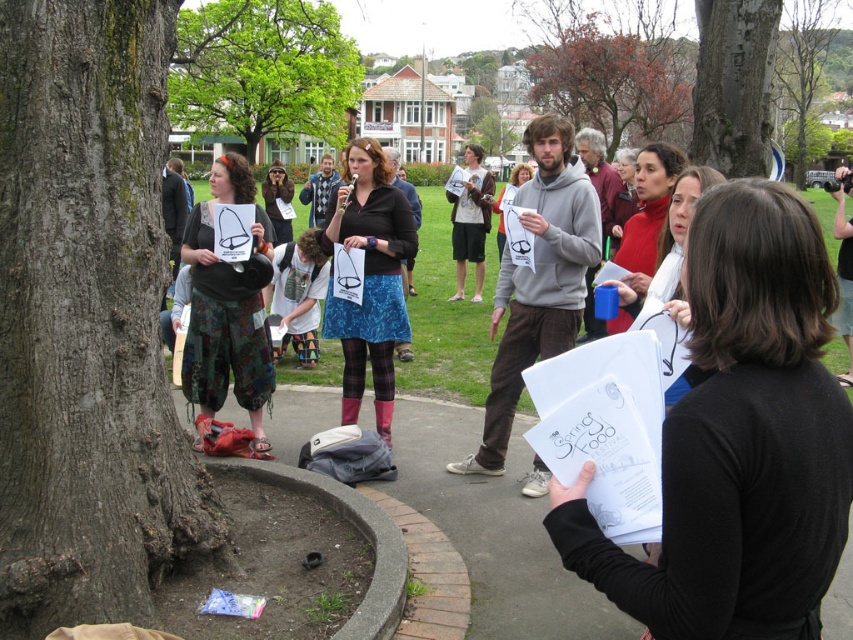
You are a photographer trying to capture the central focus of the scene. Which object, the black paper at center or the matte black hat at center, would appear larger in your photo due to its proximity to the camera?

The black paper at center appears larger in the photo because it is closer to the viewer than the matte black hat at center.

You are a photographer trying to capture a group photo of the camouflage pants at left and the matte black shirt at center. The camera can only focus on objects wider than 1 meter. Which of the two objects should you prioritize to ensure proper focus?

The matte black shirt at center should be prioritized because its width is greater than the camouflage pants at left, making it more likely to be within the camera focus range.

You are a photographer trying to capture a clear shot of both the matte black jacket at center and the matte black hat at center. Since they are both black, you need to adjust your camera settings to focus on their positions. According to the scene description, which object is located lower in the image?

The matte black jacket at center is positioned under the matte black hat at center, so the jacket is lower in the image.